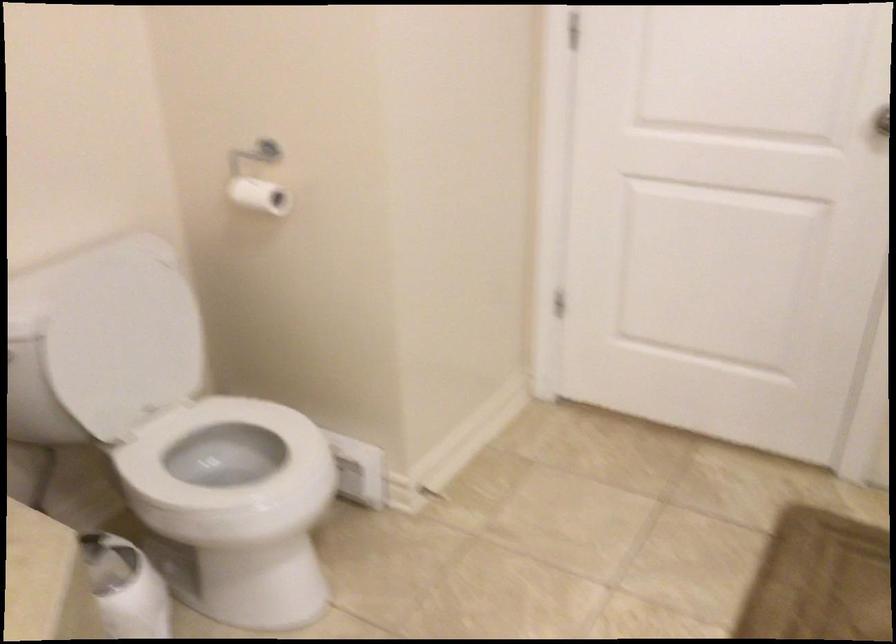
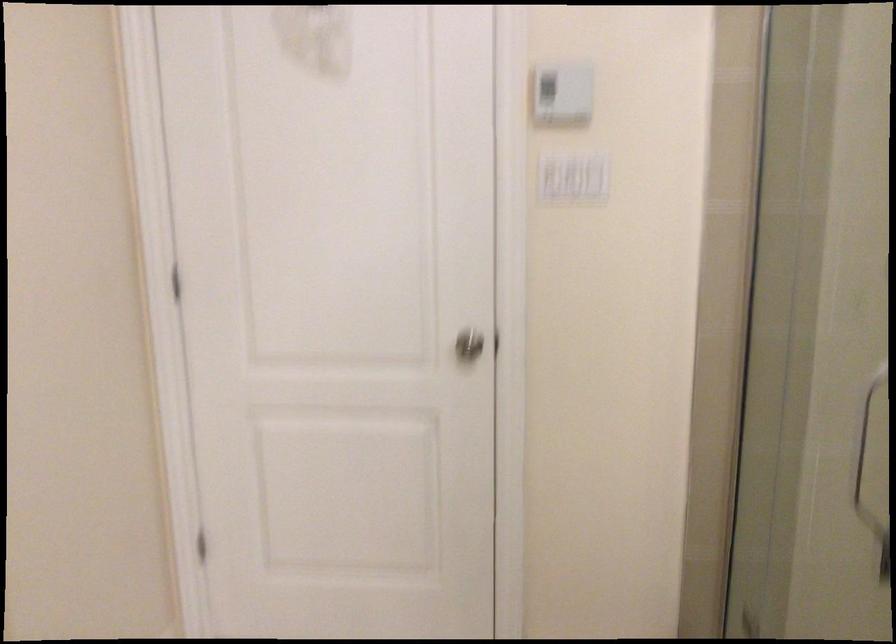
Question: The images are taken continuously from a first-person perspective. In which direction is your viewpoint rotating?

Choices:
 (A) Left
 (B) Right
 (C) Up
 (D) Down

Answer: (B)